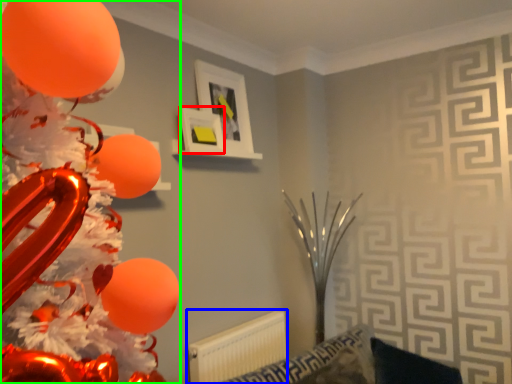
Question: Which object is the farthest from picture frame (highlighted by a red box)? Choose among these: radiator (highlighted by a blue box) or balloon (highlighted by a green box).

Choices:
 (A) radiator
 (B) balloon

Answer: (B)